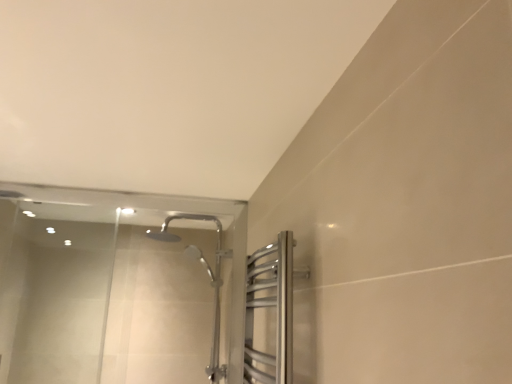
Question: Should I look upward or downward to see satin nickel towel rack at upper right?

Choices:
 (A) down
 (B) up

Answer: (A)

Question: Is transparent glass shower door at upper left outside of satin nickel towel rack at upper right?

Choices:
 (A) yes
 (B) no

Answer: (A)

Question: Can you confirm if transparent glass shower door at upper left is wider than satin nickel towel rack at upper right?

Choices:
 (A) yes
 (B) no

Answer: (B)

Question: Can you confirm if transparent glass shower door at upper left is smaller than satin nickel towel rack at upper right?

Choices:
 (A) no
 (B) yes

Answer: (A)

Question: Is transparent glass shower door at upper left oriented towards satin nickel towel rack at upper right?

Choices:
 (A) yes
 (B) no

Answer: (A)

Question: Does transparent glass shower door at upper left appear on the right side of satin nickel towel rack at upper right?

Choices:
 (A) no
 (B) yes

Answer: (A)

Question: Would you consider transparent glass shower door at upper left to be distant from satin nickel towel rack at upper right?

Choices:
 (A) yes
 (B) no

Answer: (B)

Question: Considering the relative sizes of satin nickel towel rack at upper right and transparent glass shower door at upper left in the image provided, is satin nickel towel rack at upper right wider than transparent glass shower door at upper left?

Choices:
 (A) yes
 (B) no

Answer: (A)

Question: Does satin nickel towel rack at upper right appear on the right side of transparent glass shower door at upper left?

Choices:
 (A) no
 (B) yes

Answer: (B)

Question: Is satin nickel towel rack at upper right positioned in front of transparent glass shower door at upper left?

Choices:
 (A) no
 (B) yes

Answer: (B)

Question: Is satin nickel towel rack at upper right next to transparent glass shower door at upper left?

Choices:
 (A) no
 (B) yes

Answer: (A)

Question: Considering the relative sizes of satin nickel towel rack at upper right and transparent glass shower door at upper left in the image provided, is satin nickel towel rack at upper right shorter than transparent glass shower door at upper left?

Choices:
 (A) no
 (B) yes

Answer: (B)

Question: Does satin nickel towel rack at upper right have a smaller size compared to transparent glass shower door at upper left?

Choices:
 (A) no
 (B) yes

Answer: (B)

Question: Which is correct: satin nickel towel rack at upper right is inside transparent glass shower door at upper left, or outside of it?

Choices:
 (A) inside
 (B) outside

Answer: (B)